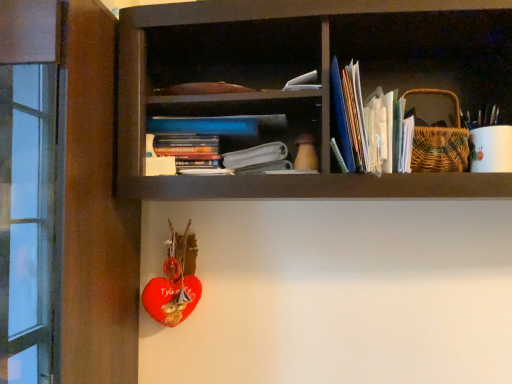
Question: Should I look upward or downward to see white paper at center?

Choices:
 (A) down
 (B) up

Answer: (B)

Question: Is there a large distance between white paper stack at upper right, placed as the second book when sorted from left to right, and hardcover book at center, which is counted as the 2th book, starting from the right?

Choices:
 (A) yes
 (B) no

Answer: (B)

Question: From a real-world perspective, is white paper stack at upper right, the first book viewed from the right, positioned over hardcover book at center, the first book in the left-to-right sequence, based on gravity?

Choices:
 (A) yes
 (B) no

Answer: (A)

Question: From a real-world perspective, is white paper stack at upper right, the first book viewed from the right, positioned under hardcover book at center, which is counted as the 2th book, starting from the right, based on gravity?

Choices:
 (A) no
 (B) yes

Answer: (A)

Question: From the image's perspective, is white paper stack at upper right, placed as the second book when sorted from left to right, under hardcover book at center, which is counted as the 2th book, starting from the right?

Choices:
 (A) yes
 (B) no

Answer: (B)

Question: Can you confirm if white paper stack at upper right, the first book viewed from the right, is positioned to the right of hardcover book at center, the first book in the left-to-right sequence?

Choices:
 (A) no
 (B) yes

Answer: (B)

Question: Does white paper stack at upper right, the first book viewed from the right, have a smaller size compared to hardcover book at center, which is counted as the 2th book, starting from the right?

Choices:
 (A) yes
 (B) no

Answer: (B)

Question: Could you tell me if white paper at center is turned towards hardcover book at center, which is counted as the 2th book, starting from the right?

Choices:
 (A) no
 (B) yes

Answer: (A)

Question: Can you confirm if white paper at center is shorter than hardcover book at center, which is counted as the 2th book, starting from the right?

Choices:
 (A) yes
 (B) no

Answer: (B)

Question: Is white paper at center located outside hardcover book at center, which is counted as the 2th book, starting from the right?

Choices:
 (A) yes
 (B) no

Answer: (A)

Question: Is white paper at center positioned behind hardcover book at center, which is counted as the 2th book, starting from the right?

Choices:
 (A) yes
 (B) no

Answer: (B)

Question: From the image's perspective, is white paper at center below hardcover book at center, the first book in the left-to-right sequence?

Choices:
 (A) yes
 (B) no

Answer: (A)

Question: From a real-world perspective, is white paper at center located higher than hardcover book at center, the first book in the left-to-right sequence?

Choices:
 (A) no
 (B) yes

Answer: (A)

Question: Is white paper stack at upper right, the first book viewed from the right, surrounding white paper at center?

Choices:
 (A) no
 (B) yes

Answer: (A)